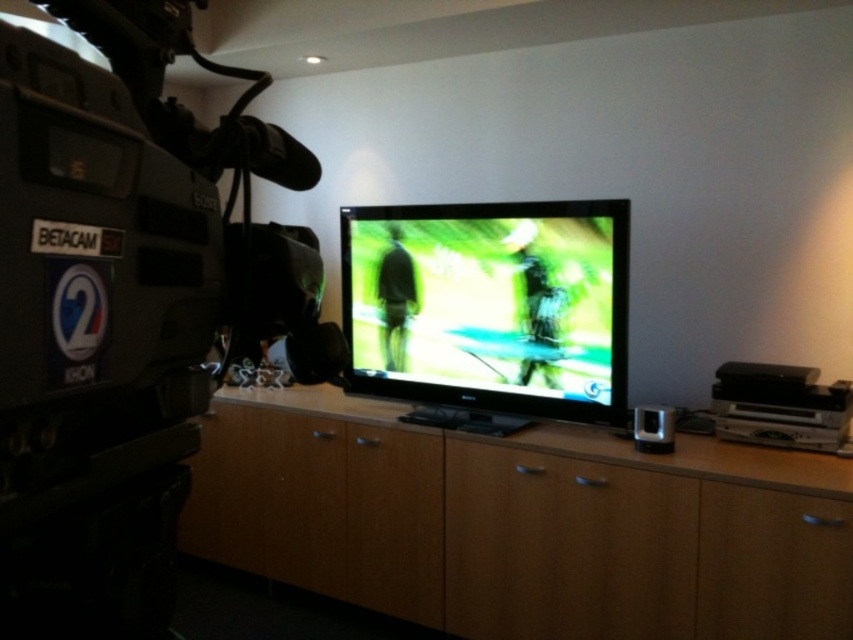
Consider the image. Can you confirm if light brown wood dresser at center is smaller than green matte screen at center?

No, light brown wood dresser at center is not smaller than green matte screen at center.

Which is behind, point (683, 440) or point (567, 362)?

The point (567, 362) is more distant.

The width and height of the screenshot is (853, 640). What do you see at coordinates (521, 522) in the screenshot?
I see `light brown wood dresser at center` at bounding box center [521, 522].

Where is `light brown wood dresser at center`? light brown wood dresser at center is located at coordinates (521, 522).